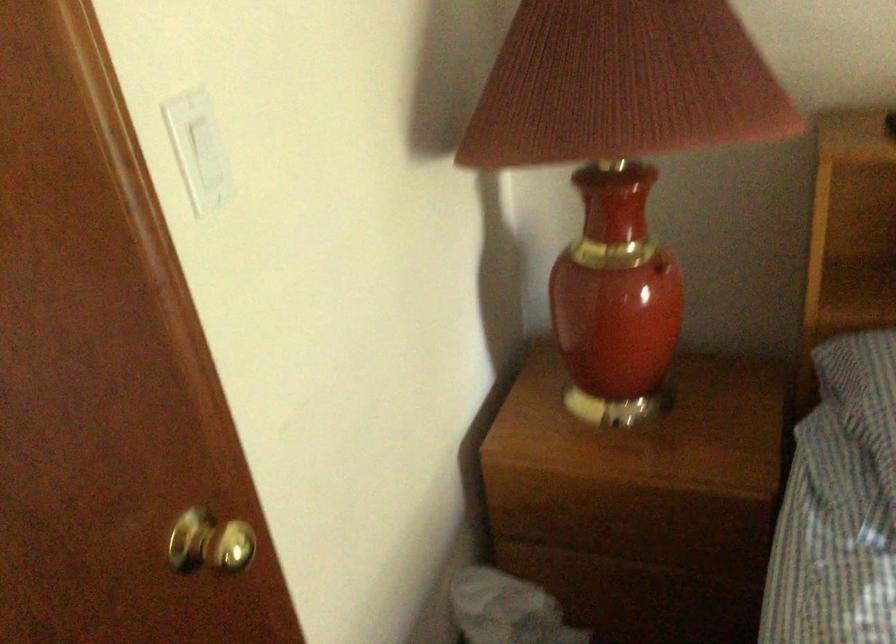
Locate an element on the screen. The width and height of the screenshot is (896, 644). white light switch is located at coordinates (197, 149).